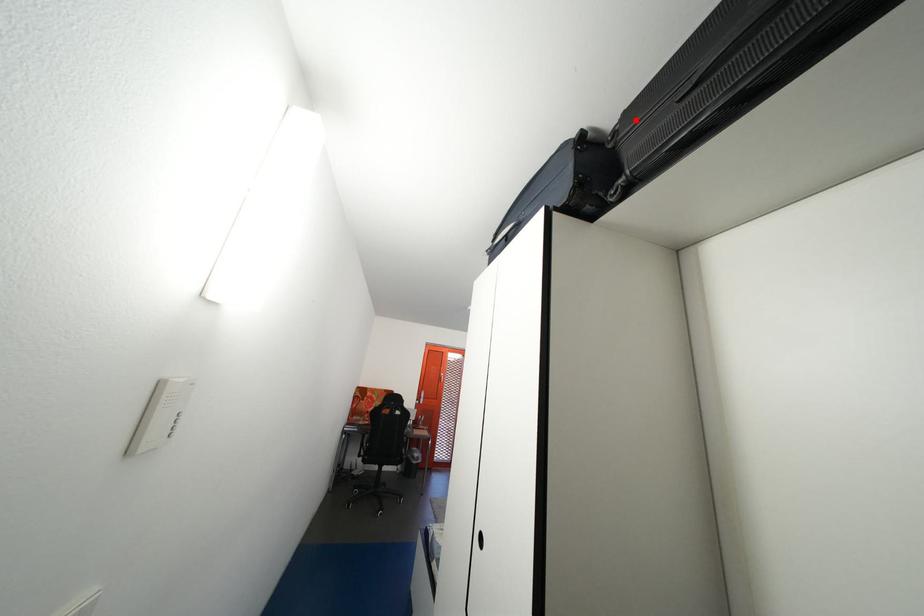
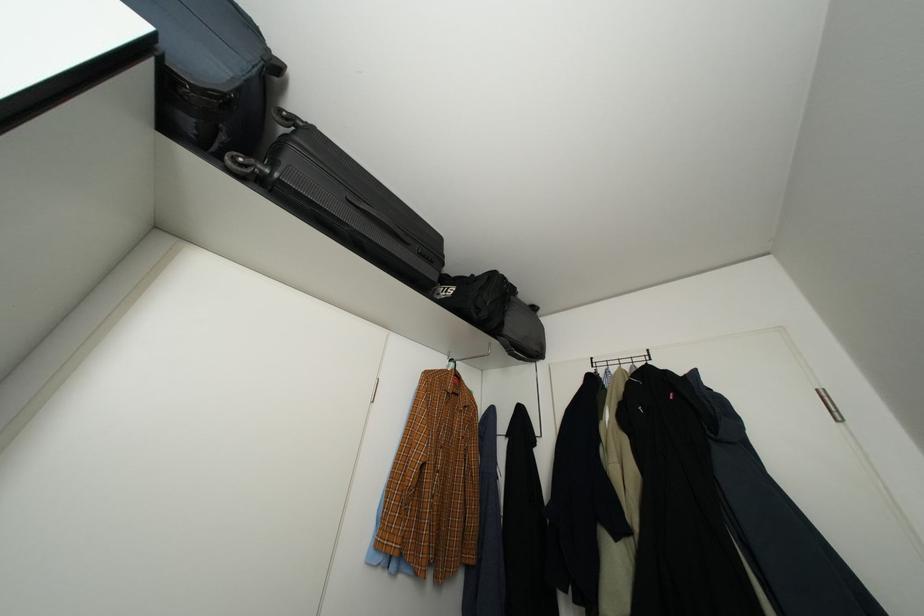
Where in the second image is the point corresponding to the highlighted location from the first image?

(323, 135)